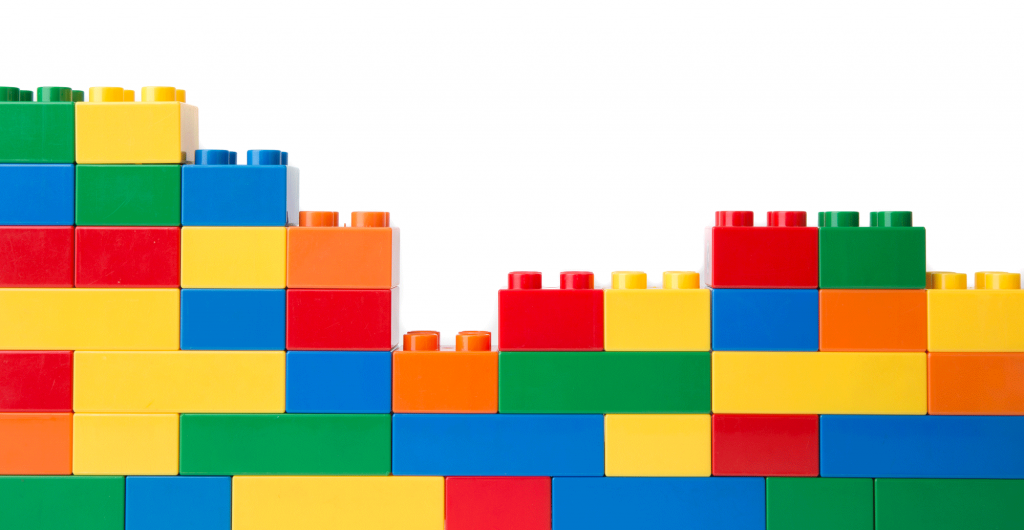
The image size is (1024, 530). Identify the location of yellow plastic building blocks. (129, 127), (95, 326), (112, 382), (113, 435), (231, 268), (309, 510), (656, 302), (660, 432), (822, 355), (956, 308).